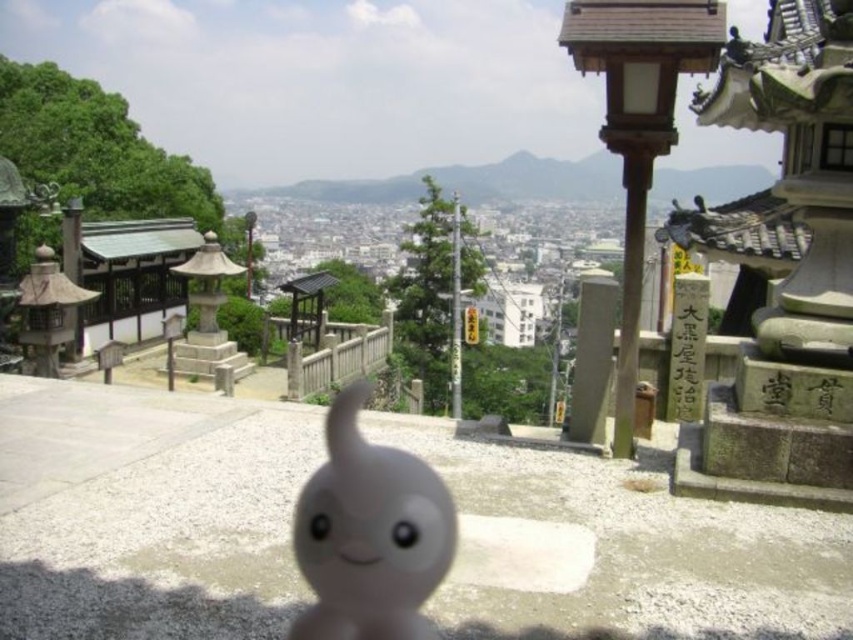
You are a visitor at the temple and want to take a photo of both the white matte ghost at center and the gray stone pillar at center. Which object should you focus on first if you want to include both in the frame without moving the camera?

You should focus on the gray stone pillar at center first because it is taller than the white matte ghost at center, allowing both to fit within the frame when centered on the pillar.

You are standing at the entrance of the temple and see the white matte ghost at center. If you want to take a closer look, how many steps would you need to take to reach it?

The white matte ghost at center is 8.14 meters away from camera. Assuming an average step length of 0.76 meters, you would need to take approximately 10.7 steps. Since you can only take whole steps, you would need to take 11 steps to reach the white matte ghost at center.

You are a visitor at the temple and want to take a photo of the white matte ghost at center and the white stone signpost at right. From your current position, which object is closer to the camera?

The white matte ghost at center is positioned under the white stone signpost at right, so the white matte ghost at center is closer to the camera.